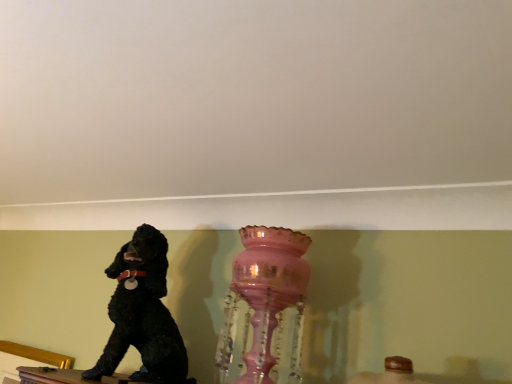
Question: Is pink glass vase at center taller or shorter than black matte dog at left?

Choices:
 (A) tall
 (B) short

Answer: (A)

Question: From a real-world perspective, is pink glass vase at center physically located above or below black matte dog at left?

Choices:
 (A) above
 (B) below

Answer: (A)

Question: Considering the positions of point (287, 306) and point (175, 359), is point (287, 306) closer or farther from the camera than point (175, 359)?

Choices:
 (A) closer
 (B) farther

Answer: (A)

Question: From the image's perspective, is black matte dog at left positioned above or below pink glass vase at center?

Choices:
 (A) above
 (B) below

Answer: (B)

Question: Considering the positions of black matte dog at left and pink glass vase at center in the image, is black matte dog at left taller or shorter than pink glass vase at center?

Choices:
 (A) short
 (B) tall

Answer: (A)

Question: Considering the positions of point coord(175,327) and point coord(251,354), is point coord(175,327) closer or farther from the camera than point coord(251,354)?

Choices:
 (A) closer
 (B) farther

Answer: (B)

Question: Considering the positions of black matte dog at left and pink glass vase at center in the image, is black matte dog at left bigger or smaller than pink glass vase at center?

Choices:
 (A) small
 (B) big

Answer: (B)